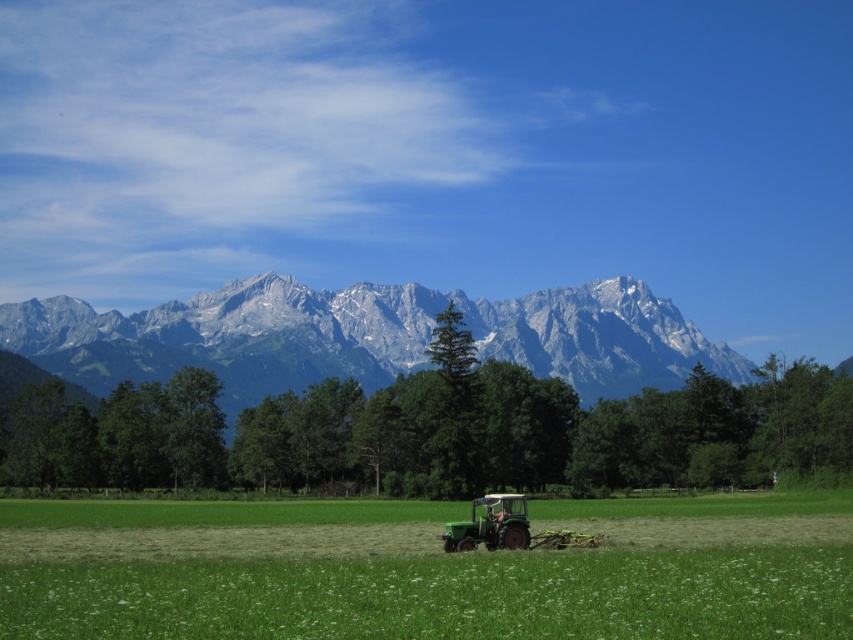
Question: Observing the image, what is the correct spatial positioning of green grass at center in reference to green matte tractor at lower center?

Choices:
 (A) above
 (B) below

Answer: (B)

Question: Which point is closer to the camera?

Choices:
 (A) (477, 502)
 (B) (648, 605)

Answer: (B)

Question: Is the position of green grass at center less distant than that of green matte tractor at lower center?

Choices:
 (A) yes
 (B) no

Answer: (A)

Question: Is green grass at center positioned at the back of green matte tractor at lower center?

Choices:
 (A) no
 (B) yes

Answer: (A)

Question: Which point is closer to the camera?

Choices:
 (A) green matte tractor at lower center
 (B) green grass at center

Answer: (B)